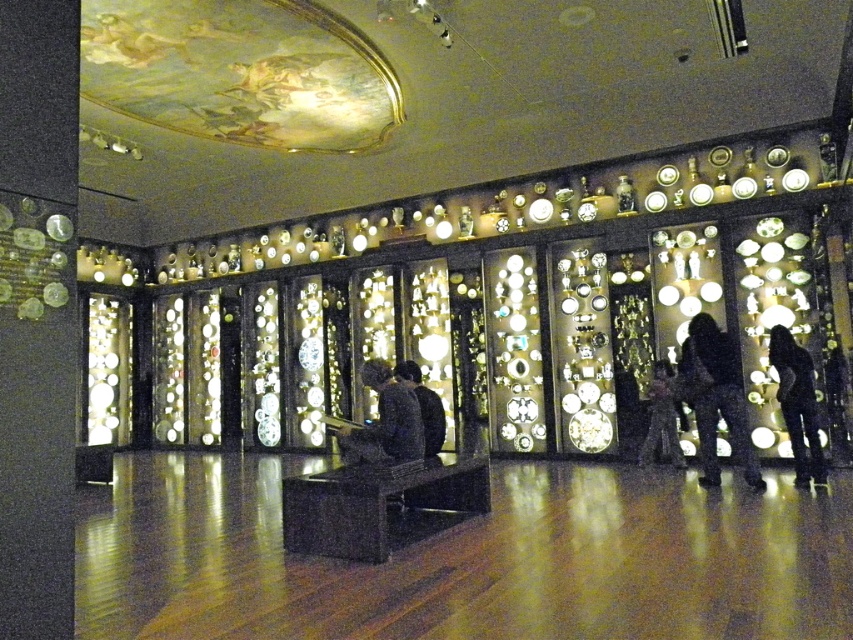
Between point (809, 433) and point (413, 387), which one is positioned behind?

The point (809, 433) is behind.

What do you see at coordinates (798, 404) in the screenshot? The height and width of the screenshot is (640, 853). I see `black matte figure at lower right` at bounding box center [798, 404].

Which is in front, point (811, 480) or point (427, 396)?

Point (427, 396) is more forward.

Locate an element on the screen. This screenshot has height=640, width=853. black matte figure at lower right is located at coordinates (798, 404).

Is dark brown leather jacket at center closer to the viewer compared to black matte figure at lower right?

Yes, dark brown leather jacket at center is closer to the viewer.

Between dark brown leather jacket at center and black matte figure at lower right, which one appears on the right side from the viewer's perspective?

black matte figure at lower right

Is point (386, 428) closer to camera compared to point (811, 458)?

Yes, it is.

The height and width of the screenshot is (640, 853). What are the coordinates of `dark brown leather jacket at center` in the screenshot? It's located at (386, 420).

Can you confirm if silvery metallic dress at center is positioned to the right of black fabric at center?

Indeed, silvery metallic dress at center is positioned on the right side of black fabric at center.

This screenshot has height=640, width=853. In order to click on silvery metallic dress at center in this screenshot , I will do `click(662, 417)`.

Is point (677, 413) closer to camera compared to point (437, 428)?

No, it is behind (437, 428).

At what (x,y) coordinates should I click in order to perform the action: click on silvery metallic dress at center. Please return your answer as a coordinate pair (x, y). The image size is (853, 640). Looking at the image, I should click on (662, 417).